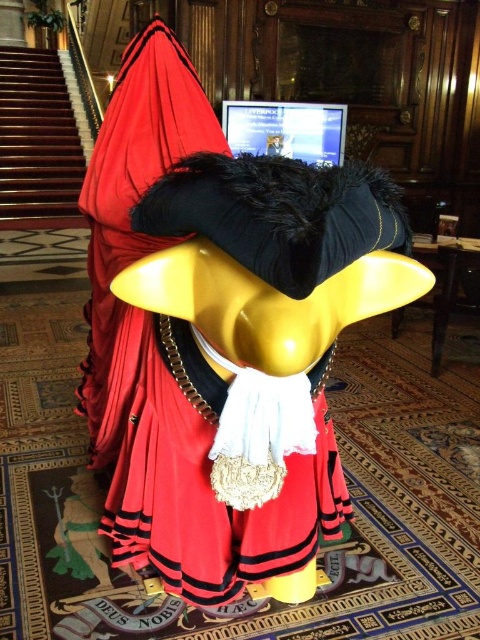
You are standing at the center of the scene. There is a point labeled as point (36, 141). What object is located at this point?

The wooden staircase at left is located at point (36, 141).

You are standing at the entrance of a grand hall and see the wooden staircase at left. If you want to go to the second floor, which direction should you head towards?

You should head towards the wooden staircase at left to reach the second floor since staircases are typically used to ascend to higher floors.